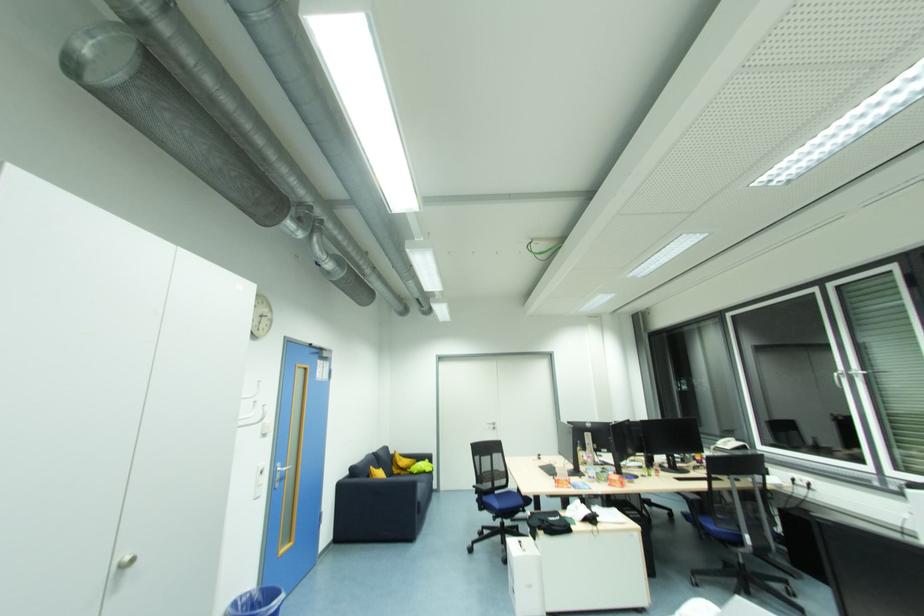
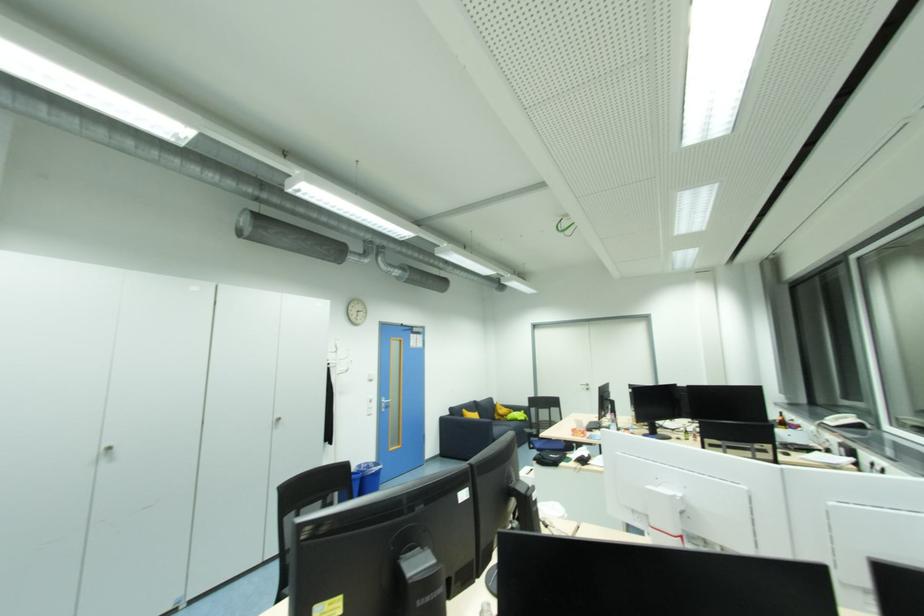
Locate, in the second image, the point that corresponds to (371,477) in the first image.

(466, 416)